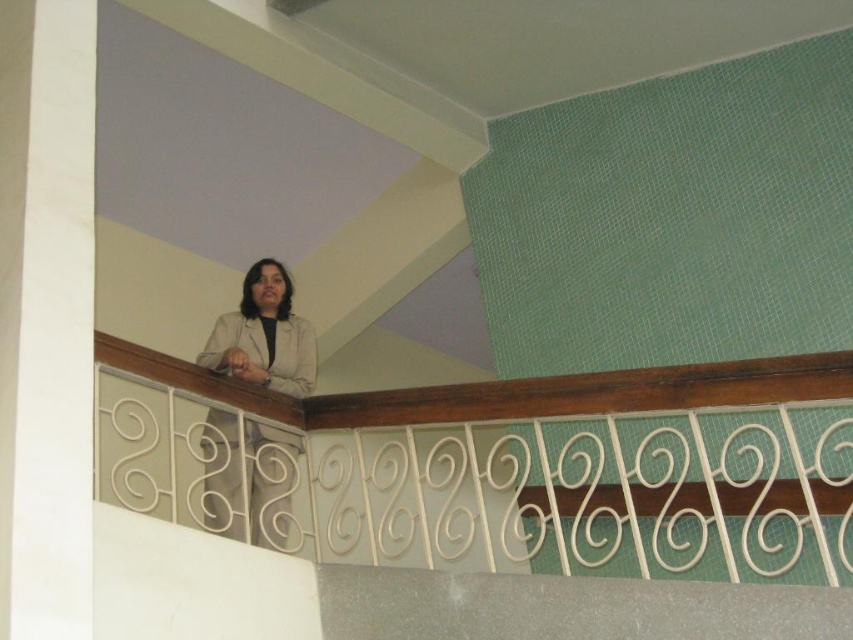
Question: Which point appears farthest from the camera in this image?

Choices:
 (A) (259, 426)
 (B) (248, 342)

Answer: (B)

Question: Does matte beige jacket at upper center appear on the right side of beige fabric lab coat at center?

Choices:
 (A) no
 (B) yes

Answer: (A)

Question: Is matte beige jacket at upper center further to camera compared to beige fabric lab coat at center?

Choices:
 (A) no
 (B) yes

Answer: (A)

Question: In this image, where is matte beige jacket at upper center located relative to beige fabric lab coat at center?

Choices:
 (A) below
 (B) above

Answer: (A)